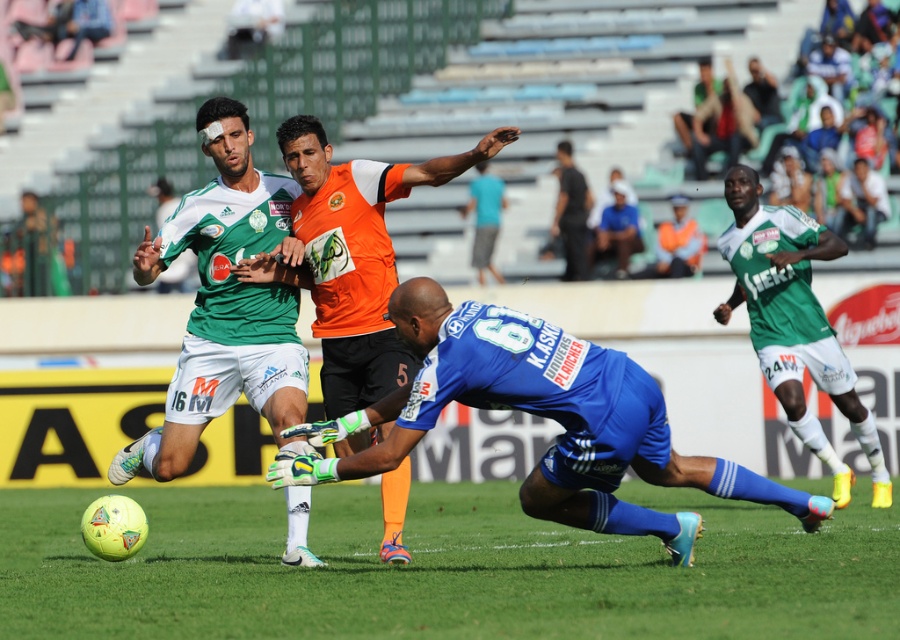
Question: Which of the following is the farthest from the observer?

Choices:
 (A) (406, 484)
 (B) (302, 540)
 (C) (564, 276)

Answer: (C)

Question: Observing the image, what is the correct spatial positioning of orange matte jersey at center in reference to green jersey at center?

Choices:
 (A) above
 (B) below

Answer: (A)

Question: Which of the following is the farthest from the observer?

Choices:
 (A) (744, 470)
 (B) (493, 269)
 (C) (146, 269)
 (D) (387, 477)

Answer: (B)

Question: Which point is farther to the camera?

Choices:
 (A) orange matte jersey at center
 (B) green matte jersey at center
 (C) yellow matte football at center

Answer: (A)

Question: Can you confirm if green matte jersey at center is thinner than blue fabric cap at upper center?

Choices:
 (A) no
 (B) yes

Answer: (A)

Question: Can you confirm if black matte shirt at center is smaller than blue fabric cap at upper center?

Choices:
 (A) no
 (B) yes

Answer: (A)